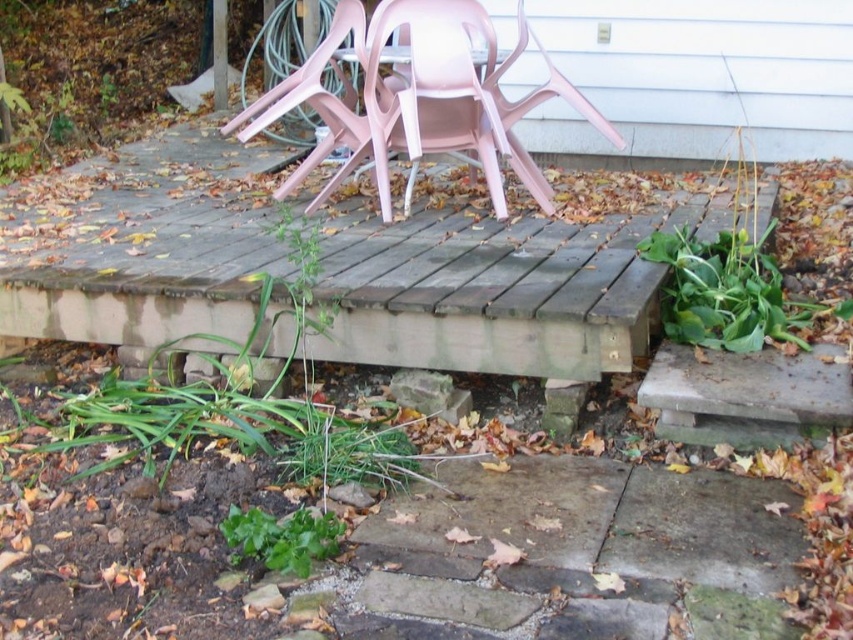
You are planning to place a new rectangular garden bed that is 2 meters long and 1 meter wide on the weathered wood deck at center. The garden bed needs to be placed next to the pink plastic chairs at upper center. Based on the deck and chairs dimensions, can the garden bed fit on the deck without overlapping the chairs?

The weathered wood deck at center might be wider than the pink plastic chairs at upper center, so there is a possibility that the garden bed could fit next to the chairs. However, without exact measurements, it is uncertain if the deck has enough space. Consider measuring the deck width and ensuring the garden bed dimensions align with available space.

You are planning to place a large potted plant that requires a sturdy surface. Based on the scene, which object between the weathered wood deck at center and the pink plastic chairs at upper center would be more suitable for placing the plant?

The weathered wood deck at center is bigger than the pink plastic chairs at upper center, making it a more stable and suitable surface for placing the large potted plant.